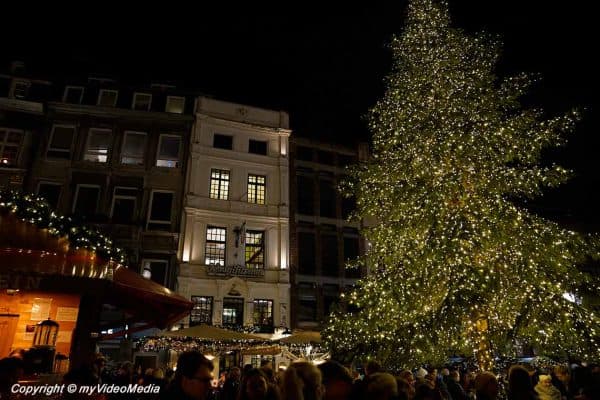
This screenshot has width=600, height=400. In order to click on lit up wall in this screenshot , I will do `click(6, 300)`, `click(59, 304)`, `click(69, 325)`.